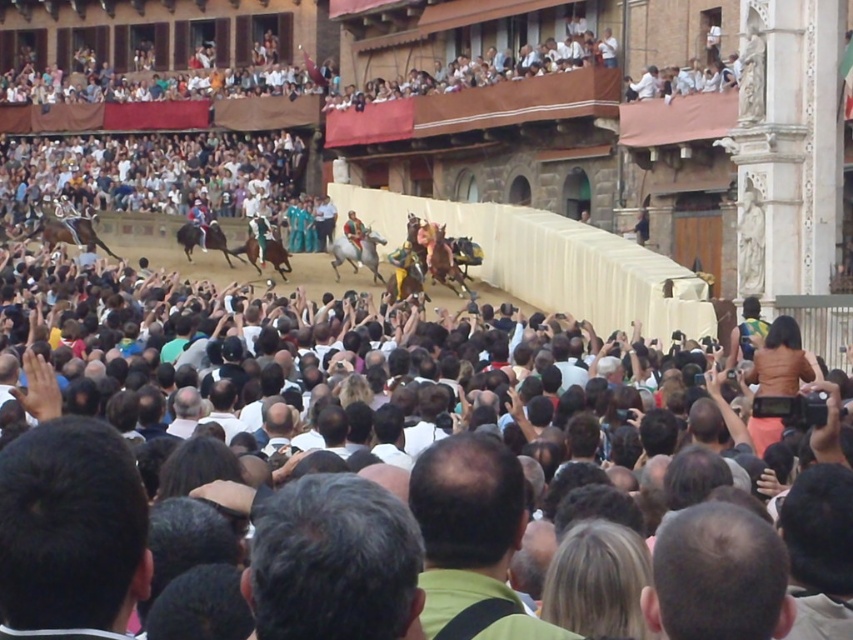
Question: Among these objects, which one is nearest to the camera?

Choices:
 (A) white glossy horse at center
 (B) dark brown hair at center
 (C) shiny gold horse at center

Answer: (B)

Question: Which object is positioned closest to the gray hair at center?

Choices:
 (A) shiny gold horse at center
 (B) dark green shirt at center
 (C) dark brown hair at lower left
 (D) white glossy horse at center

Answer: (C)

Question: Is dark brown hair at lower left thinner than dark brown hair at center?

Choices:
 (A) yes
 (B) no

Answer: (B)

Question: Is dark brown hair at center smaller than shiny black horse at center?

Choices:
 (A) yes
 (B) no

Answer: (A)

Question: Which object is positioned farthest from the shiny black horse at center?

Choices:
 (A) white glossy horse at center
 (B) shiny brown horse at center

Answer: (A)

Question: Can you confirm if dark green shirt at center is wider than shiny brown horse at center?

Choices:
 (A) yes
 (B) no

Answer: (A)